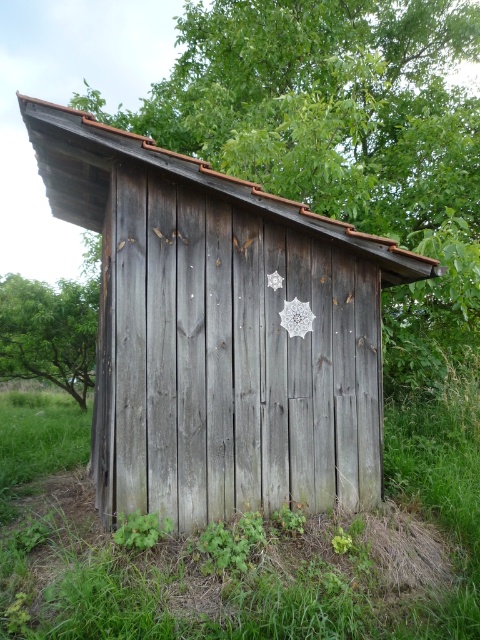
You are standing in a natural setting and see the weathered wood barn at center and the green grass at lower center. Which object is positioned to the right of the other?

The weathered wood barn at center is to the right of green grass at lower center.

You are standing in front of the rustic wooden structure and notice two green elements in the scene. The green wood at center and the green matte leaf at lower left. Which of these two items is closer to you?

A: The green wood at center is closer to you because the green matte leaf at lower left is behind it.